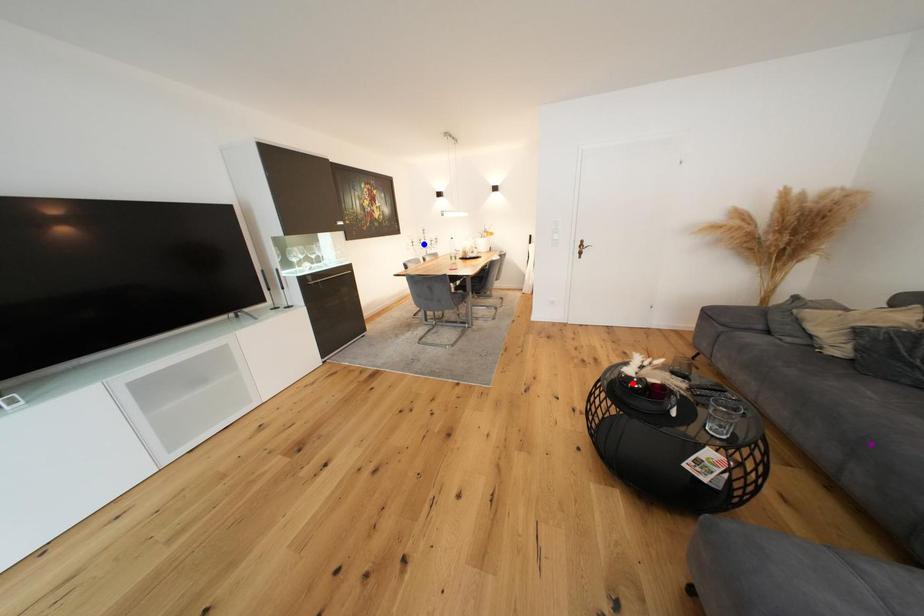
Looking at this image, order these from nearest to farthest:
- red point
- blue point
- purple point

blue point, red point, purple point